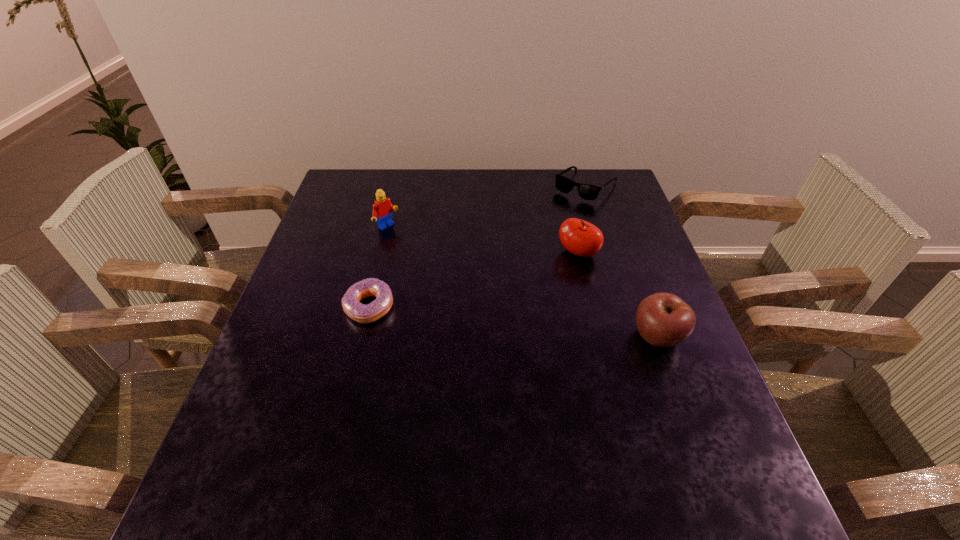
Where is `free space on the desktop that is between the doughnut and the right apple and is positioned on the stem of the farther apple`? The width and height of the screenshot is (960, 540). free space on the desktop that is between the doughnut and the right apple and is positioned on the stem of the farther apple is located at coordinates (489, 319).

Find the location of a particular element. This screenshot has width=960, height=540. vacant space on the desktop that is between the doughnut and the shorter apple and is positioned on the front-facing side of the fourth nearest object is located at coordinates (513, 322).

Locate an element on the screen. The width and height of the screenshot is (960, 540). free spot on the desktop that is between the doughnut and the shorter apple and is positioned on the front-facing side of the sunglasses is located at coordinates (476, 318).